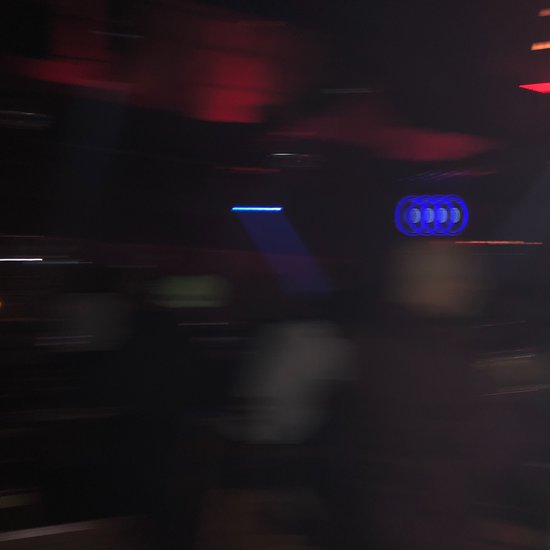
You are a GUI agent. You are given a task and a screenshot of the screen. Output one action in this format:
    pyautogui.click(x=<x>, y=<y>)
    Task: Click on the orange light
    
    Given the screenshot: What is the action you would take?
    pyautogui.click(x=540, y=47)